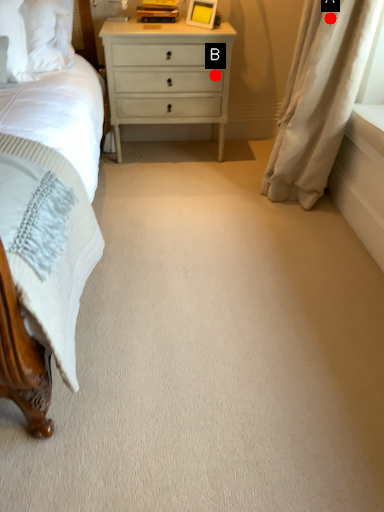
Question: Two points are circled on the image, labeled by A and B beside each circle. Among these points, which one is nearest to the camera?

Choices:
 (A) A is closer
 (B) B is closer

Answer: (A)